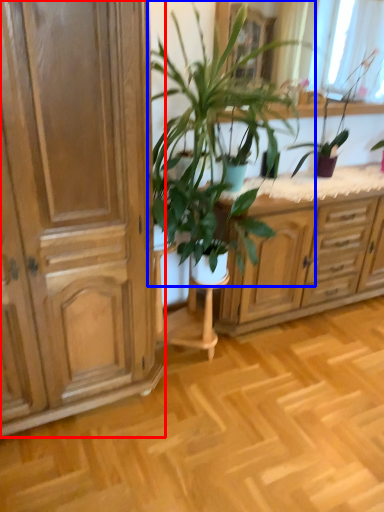
Question: Which of the following is the closest to the observer, cabinetry (highlighted by a red box) or houseplant (highlighted by a blue box)?

Choices:
 (A) cabinetry
 (B) houseplant

Answer: (A)